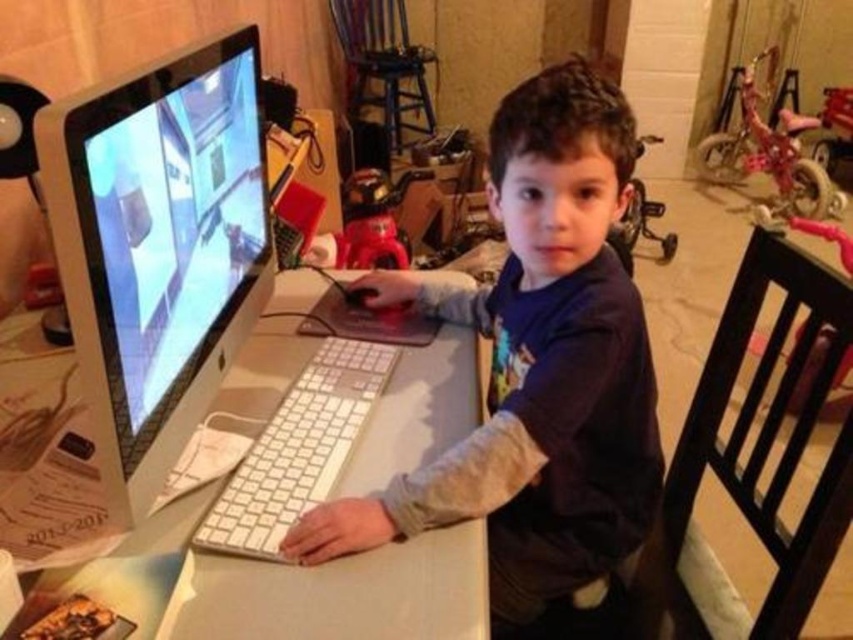
In the scene shown: You are a photographer standing in front of the desk. You want to take a photo of the white plastic monitor at center and the white plastic computer desk at center. Which object will appear larger in the photo?

The white plastic monitor at center will appear larger in the photo because it is closer to the viewer than the white plastic computer desk at center.

You are standing in front of the desk where the boy is working. The boy is wearing a matte white shirt at center. If you want to hand him a document without moving your position, can you reach him given that your maximum reaching distance is 25 inches?

The distance between you and the matte white shirt at center is 26.77 inches, which exceeds your maximum reaching distance of 25 inches. Therefore, you cannot reach him without moving.